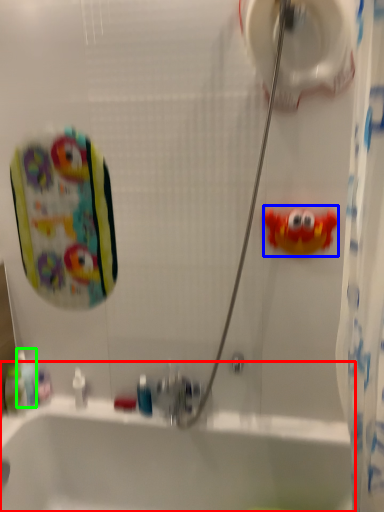
Question: Considering the real-world distances, which object is closest to bathtub (highlighted by a red box)? toy (highlighted by a blue box) or mouthwash (highlighted by a green box).

Choices:
 (A) toy
 (B) mouthwash

Answer: (B)